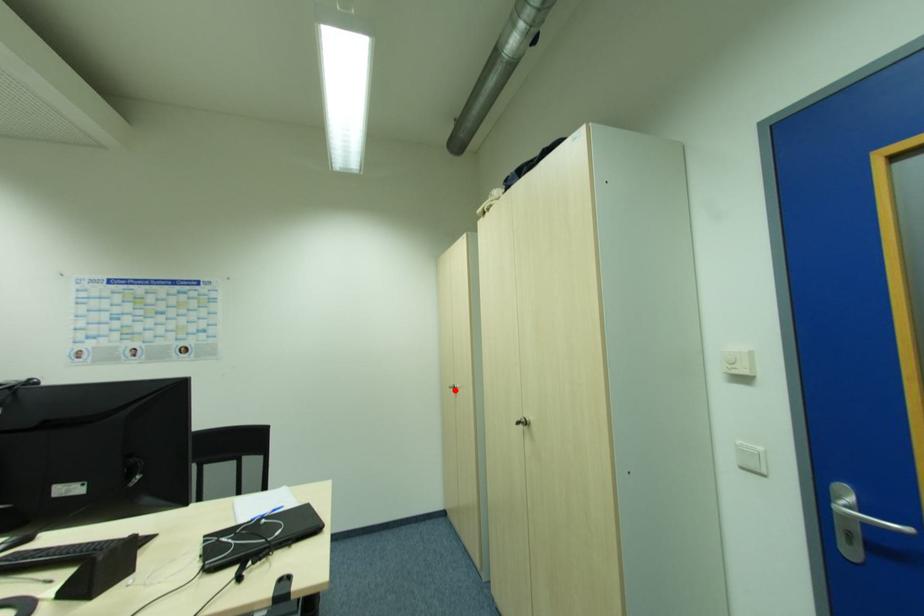
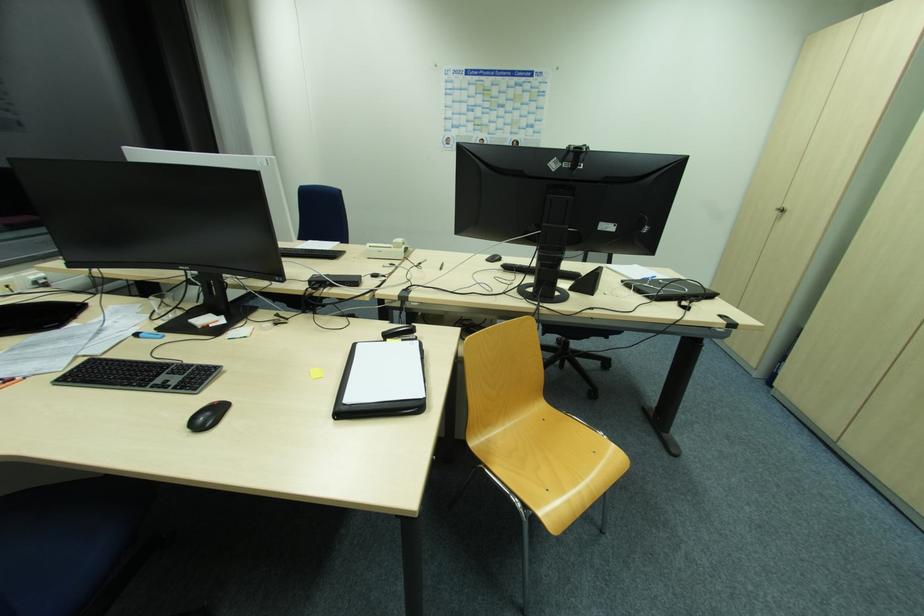
Where in the second image is the point corresponding to the highlighted location from the first image?

(779, 214)